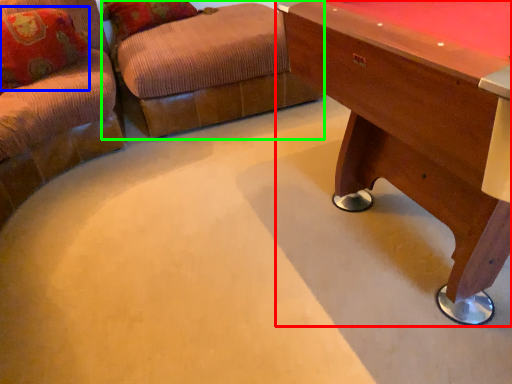
Question: Which is farther away from table (highlighted by a red box)? pillow (highlighted by a blue box) or swivel chair (highlighted by a green box)?

Choices:
 (A) pillow
 (B) swivel chair

Answer: (A)